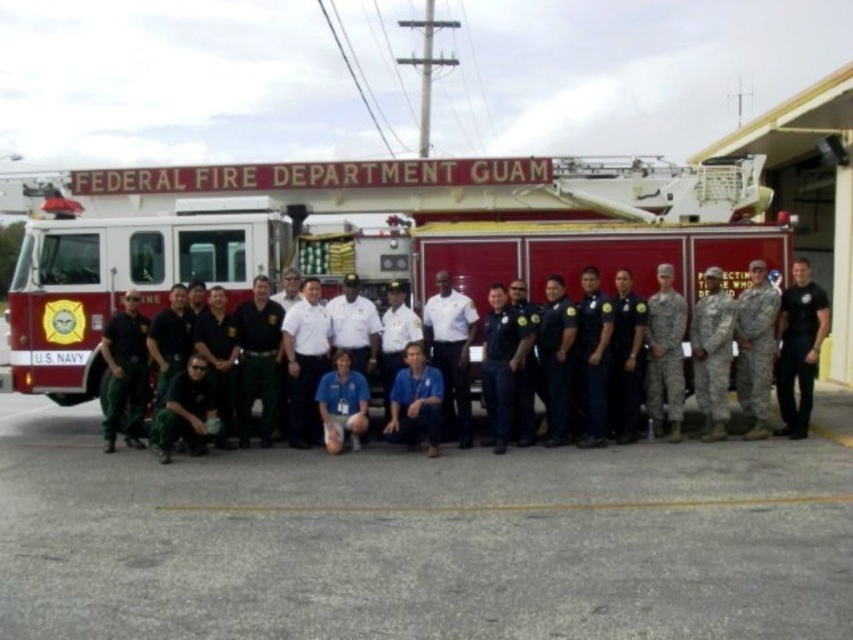
Does black cotton t-shirt at center have a larger size compared to green uniform at center?

Yes.

The width and height of the screenshot is (853, 640). What do you see at coordinates (799, 348) in the screenshot?
I see `black cotton t-shirt at center` at bounding box center [799, 348].

Locate an element on the screen. black cotton t-shirt at center is located at coordinates 799,348.

You are a GUI agent. You are given a task and a screenshot of the screen. Output one action in this format:
    pyautogui.click(x=<x>, y=<y>)
    Task: Click on the red matte fire truck at center
    This screenshot has width=853, height=640.
    Given the screenshot: What is the action you would take?
    pyautogui.click(x=370, y=237)

Is red matte fire truck at center to the right of white shirt at center from the viewer's perspective?

In fact, red matte fire truck at center is to the left of white shirt at center.

Identify the location of red matte fire truck at center. This screenshot has width=853, height=640. (370, 237).

Where is `red matte fire truck at center`? The height and width of the screenshot is (640, 853). red matte fire truck at center is located at coordinates (370, 237).

Is red matte fire truck at center taller than dark green uniform at center?

Indeed, red matte fire truck at center has a greater height compared to dark green uniform at center.

At what (x,y) coordinates should I click in order to perform the action: click on red matte fire truck at center. Please return your answer as a coordinate pair (x, y). Looking at the image, I should click on (370, 237).